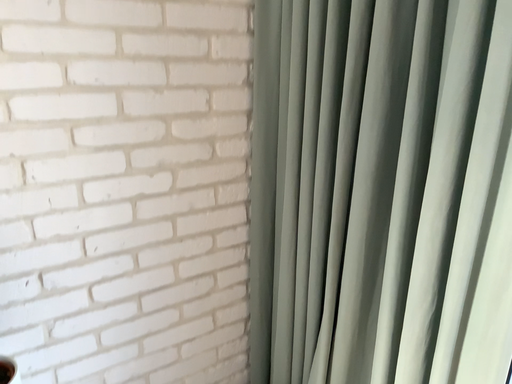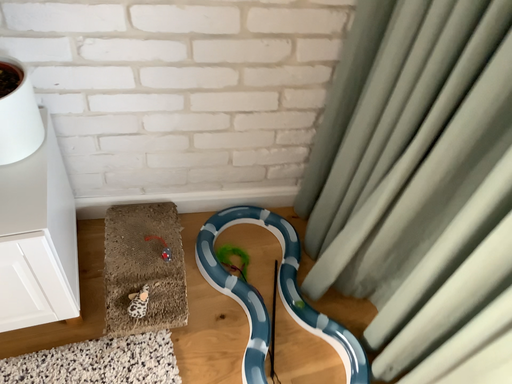
Question: Which way did the camera rotate in the video?

Choices:
 (A) rotated right
 (B) rotated left

Answer: (B)